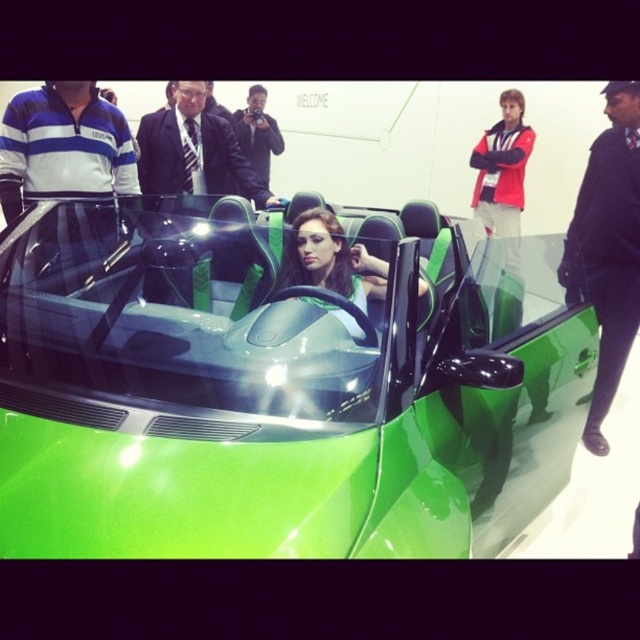
Does point (572, 292) come farther from viewer compared to point (230, 157)?

No, (572, 292) is in front of (230, 157).

Does point (612, 102) lie behind point (188, 138)?

No.

Locate an element on the screen. velvet black suit at right is located at coordinates (608, 248).

Can you confirm if blue striped polo shirt at left is positioned to the left of shiny black suit at center?

Correct, you'll find blue striped polo shirt at left to the left of shiny black suit at center.

Can you confirm if blue striped polo shirt at left is smaller than shiny black suit at center?

Yes, blue striped polo shirt at left is smaller than shiny black suit at center.

Where is `blue striped polo shirt at left`? This screenshot has height=640, width=640. blue striped polo shirt at left is located at coordinates (64, 147).

Identify the location of blue striped polo shirt at left. (64, 147).

Does matte black suit at center appear under shiny black suit at center?

Indeed, matte black suit at center is positioned under shiny black suit at center.

At what (x,y) coordinates should I click in order to perform the action: click on matte black suit at center. Please return your answer as a coordinate pair (x, y). This screenshot has width=640, height=640. Looking at the image, I should click on (193, 150).

Where is `matte black suit at center`? The width and height of the screenshot is (640, 640). matte black suit at center is located at coordinates (193, 150).